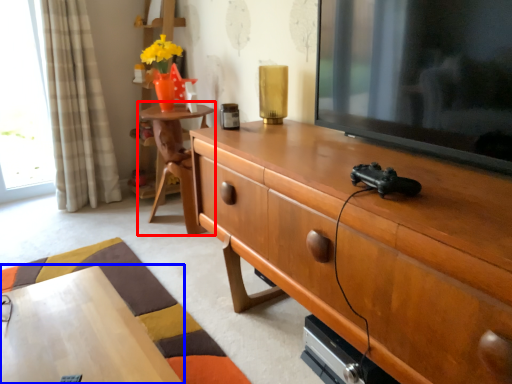
Question: Among these objects, which one is nearest to the camera, table (highlighted by a red box) or desk (highlighted by a blue box)?

Choices:
 (A) table
 (B) desk

Answer: (B)